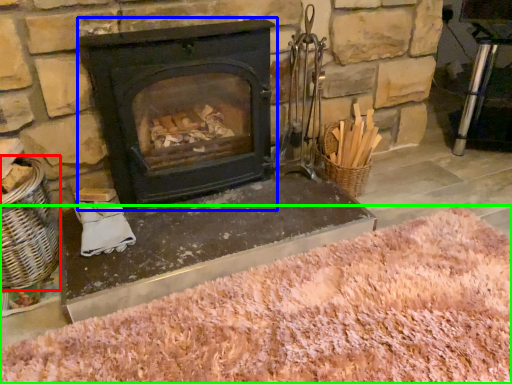
Question: Which object is positioned farthest from basket (highlighted by a red box)? Select from wood burning stove (highlighted by a blue box) and sand (highlighted by a green box).

Choices:
 (A) wood burning stove
 (B) sand

Answer: (B)